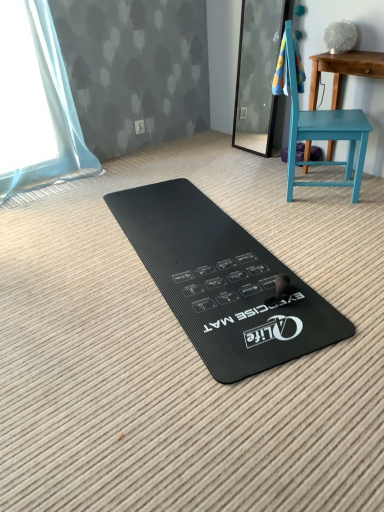
Find the location of a particular element. Image resolution: width=384 pixels, height=512 pixels. vacant area in front of teal painted wood table at right is located at coordinates (346, 212).